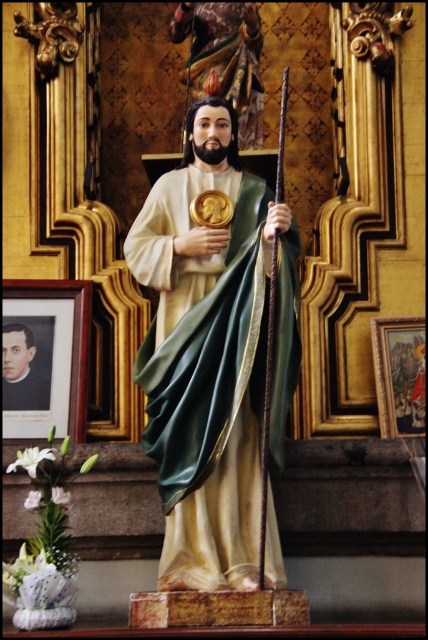
Can you confirm if green satin robe at center is positioned below smooth black portrait at lower left?

No, green satin robe at center is not below smooth black portrait at lower left.

In the scene shown: Can you confirm if green satin robe at center is thinner than smooth black portrait at lower left?

In fact, green satin robe at center might be wider than smooth black portrait at lower left.

Does point (181, 440) come closer to viewer compared to point (21, 384)?

Yes.

I want to click on green satin robe at center, so click(x=204, y=376).